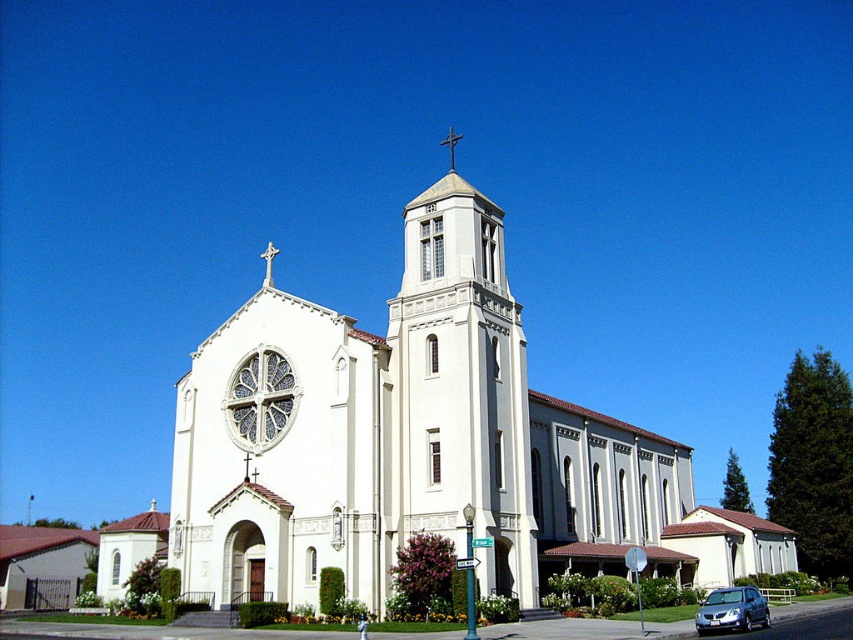
Question: Can you confirm if white smooth steeple at center is positioned below satin silver sedan at lower right?

Choices:
 (A) yes
 (B) no

Answer: (B)

Question: Is white smooth steeple at center to the left of white stone cross at upper center from the viewer's perspective?

Choices:
 (A) yes
 (B) no

Answer: (B)

Question: Estimate the real-world distances between objects in this image. Which object is closer to the white stone cross at upper center?

Choices:
 (A) metallic cross at upper center
 (B) satin silver sedan at lower right
 (C) white smooth steeple at center

Answer: (C)

Question: Which of the following is the closest to the observer?

Choices:
 (A) white smooth steeple at center
 (B) metallic cross at upper center
 (C) white stone cross at upper center
 (D) satin silver sedan at lower right

Answer: (D)

Question: Observing the image, what is the correct spatial positioning of white smooth steeple at center in reference to metallic cross at upper center?

Choices:
 (A) above
 (B) below

Answer: (B)

Question: Among these objects, which one is nearest to the camera?

Choices:
 (A) white stone cross at upper center
 (B) metallic cross at upper center
 (C) satin silver sedan at lower right

Answer: (C)